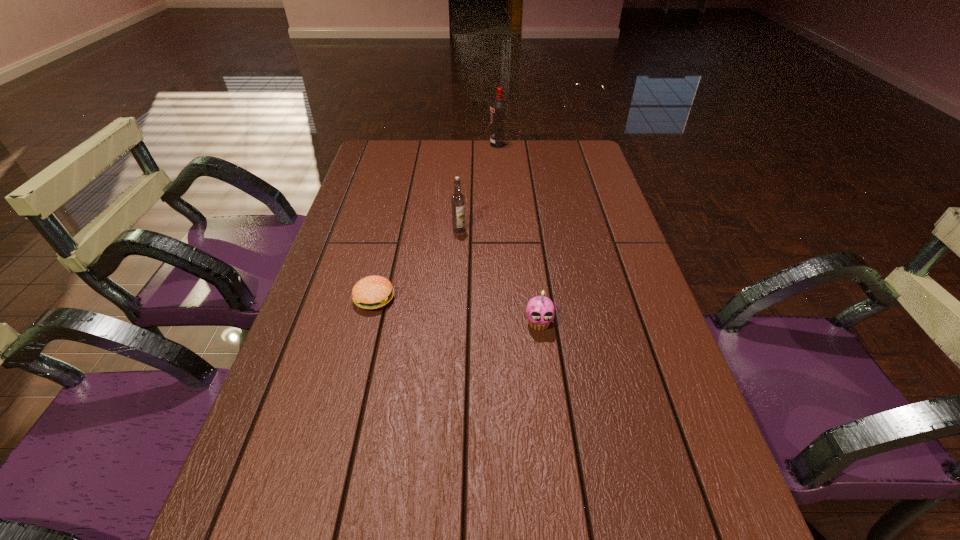
The height and width of the screenshot is (540, 960). What are the coordinates of `free space located 0.080m on the front label of the taller vodka` in the screenshot? It's located at (468, 145).

Locate an element on the screen. The width and height of the screenshot is (960, 540). free region located on the label of the nearer vodka is located at coordinates (456, 282).

Locate an element on the screen. free space located 0.160m on the face of the third tallest object is located at coordinates (549, 400).

Locate an element on the screen. This screenshot has width=960, height=540. free region located 0.090m on the left of the leftmost object is located at coordinates (316, 299).

Locate an element on the screen. Image resolution: width=960 pixels, height=540 pixels. object located at the far edge is located at coordinates (498, 109).

Where is `object that is at the left edge`? object that is at the left edge is located at coordinates (372, 292).

Where is `blank area at the far edge`? blank area at the far edge is located at coordinates (539, 144).

Find the location of a particular element. vacant space at the left edge of the desktop is located at coordinates (315, 370).

At what (x,y) coordinates should I click in order to perform the action: click on vacant region at the right edge of the desktop. Please return your answer as a coordinate pair (x, y). The height and width of the screenshot is (540, 960). Looking at the image, I should click on (650, 478).

This screenshot has width=960, height=540. Identify the location of vacant space at the far left corner of the desktop. (383, 171).